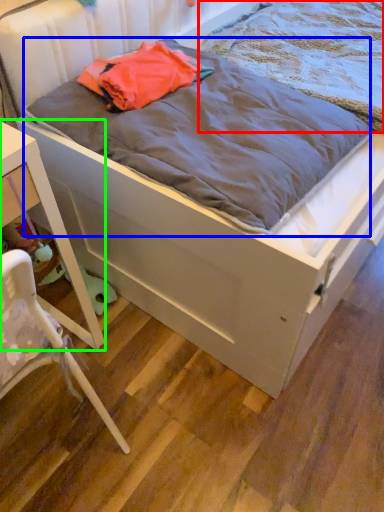
Question: Which object is the closest to the blanket (highlighted by a red box)? Choose among these: blanket (highlighted by a blue box) or nightstand (highlighted by a green box).

Choices:
 (A) blanket
 (B) nightstand

Answer: (A)